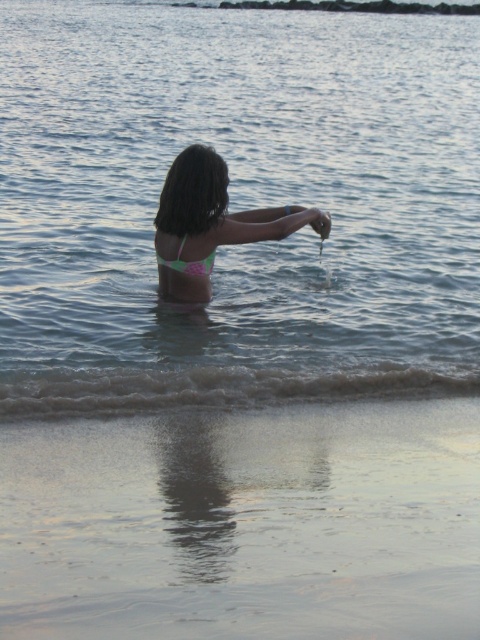
Question: Observing the image, what is the correct spatial positioning of pink bikini at center in reference to green matte bikini at center?

Choices:
 (A) right
 (B) left

Answer: (A)

Question: Which point is closer to the camera?

Choices:
 (A) (159, 257)
 (B) (315, 211)

Answer: (B)

Question: Which of the following is the farthest from the observer?

Choices:
 (A) (208, 269)
 (B) (360, 76)
 (C) (324, 230)

Answer: (B)

Question: Is clear water at center thinner than pink bikini at center?

Choices:
 (A) yes
 (B) no

Answer: (B)

Question: Can you confirm if clear water at center is wider than green matte bikini at center?

Choices:
 (A) yes
 (B) no

Answer: (A)

Question: Which point is farther to the camera?

Choices:
 (A) green matte bikini at center
 (B) clear water at center
 (C) smooth sand at lower center
 (D) smooth skin hand at upper center

Answer: (D)